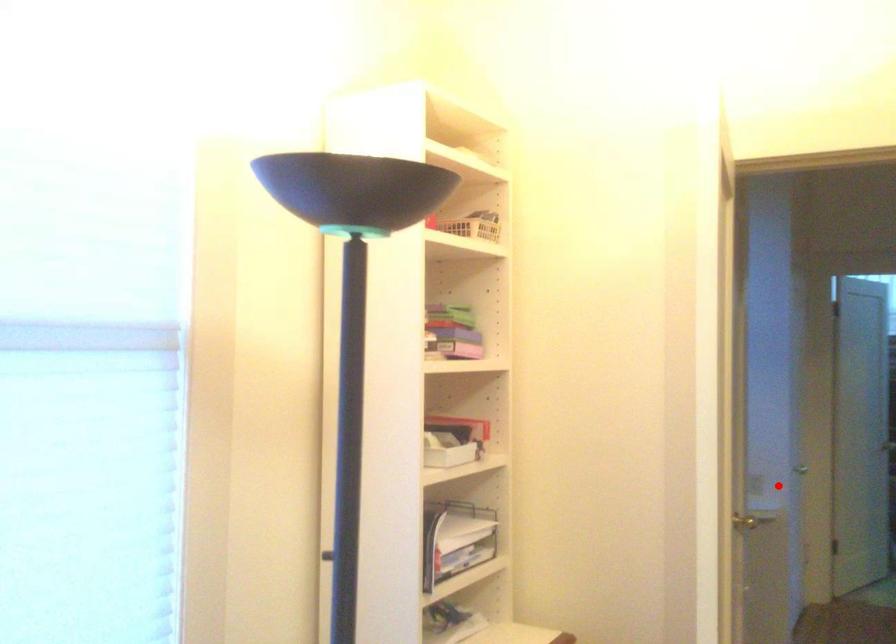
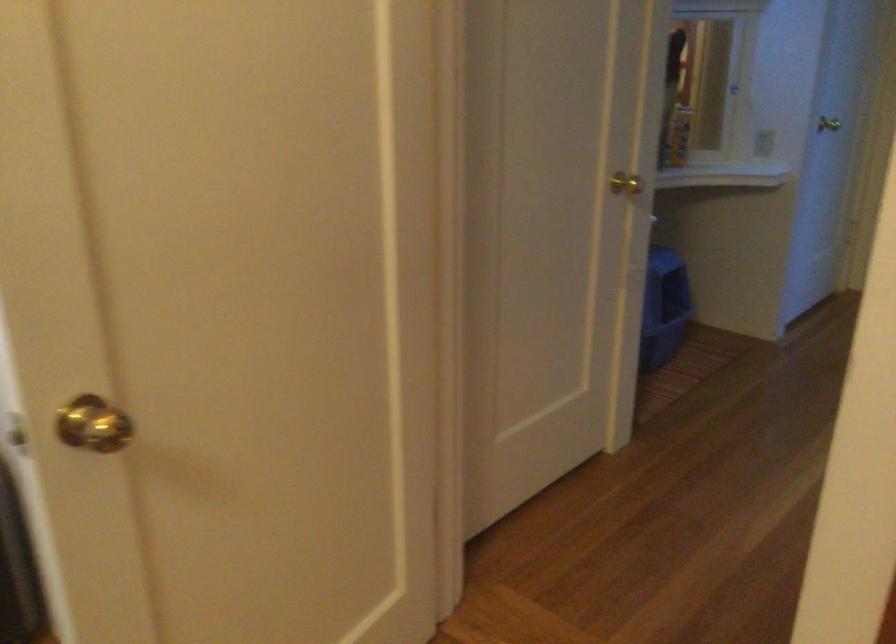
Find the pixel in the second image that matches the highlighted location in the first image.

(762, 143)